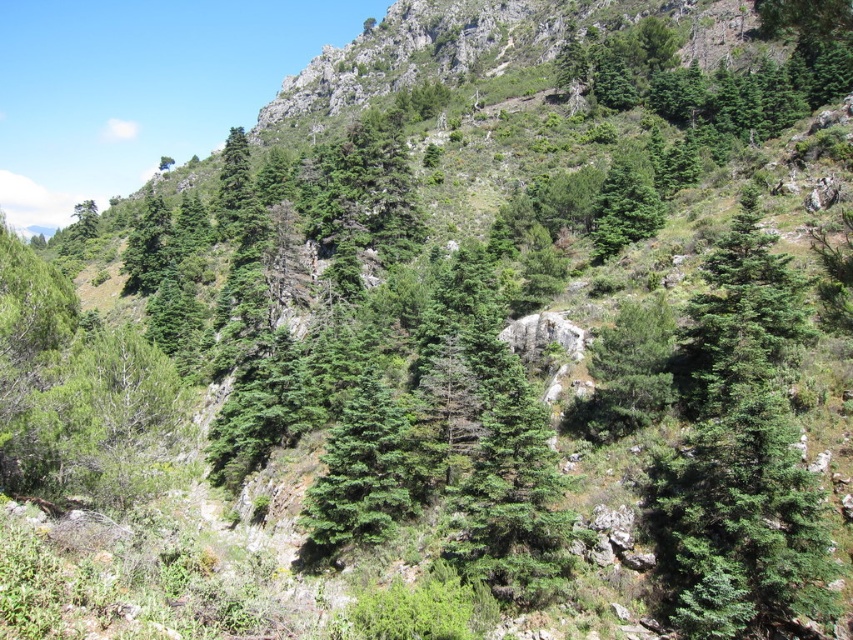
Question: Can you confirm if green matte tree at center-right is positioned below green matte tree at upper center?

Choices:
 (A) yes
 (B) no

Answer: (A)

Question: Among these points, which one is nearest to the camera?

Choices:
 (A) (646, 490)
 (B) (596, 250)

Answer: (A)

Question: Where is green matte tree at center-right located in relation to green matte tree at upper center in the image?

Choices:
 (A) above
 (B) below

Answer: (B)

Question: Which point is closer to the camera?

Choices:
 (A) (753, 205)
 (B) (643, 168)

Answer: (A)

Question: Is the position of green matte tree at center-right less distant than that of green matte tree at upper center?

Choices:
 (A) no
 (B) yes

Answer: (B)